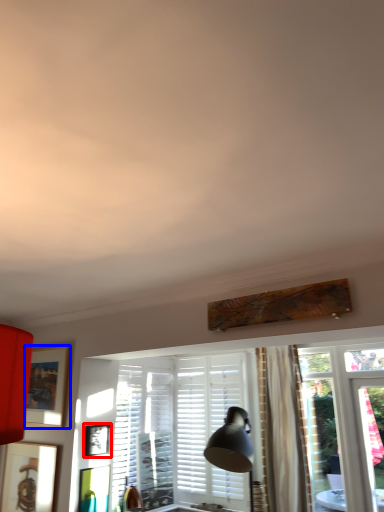
Question: Which object is closer to the camera taking this photo, picture frame (highlighted by a red box) or picture frame (highlighted by a blue box)?

Choices:
 (A) picture frame
 (B) picture frame

Answer: (A)